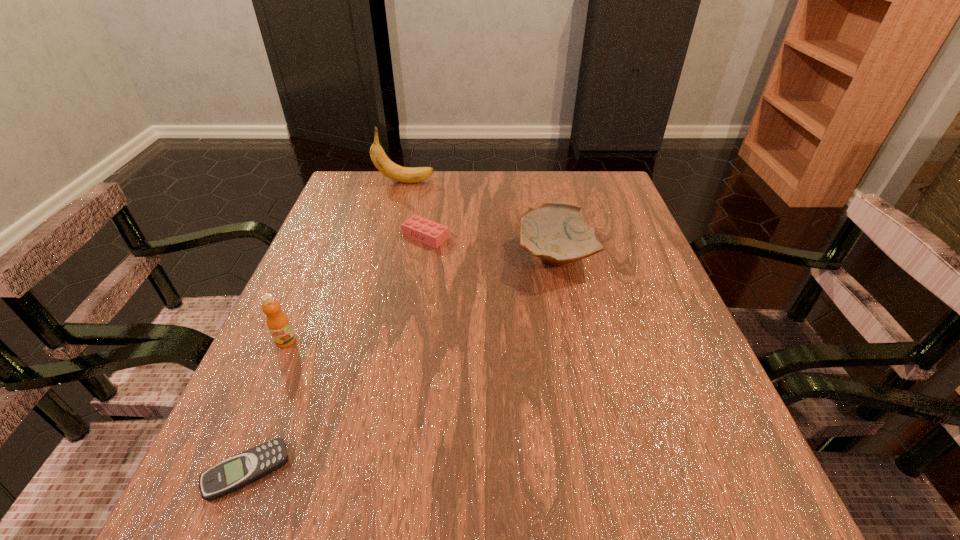
The width and height of the screenshot is (960, 540). What are the coordinates of `the tallest object` in the screenshot? It's located at (388, 168).

Locate an element on the screen. This screenshot has height=540, width=960. banana is located at coordinates (388, 168).

Identify the location of the second nearest object. (278, 324).

The width and height of the screenshot is (960, 540). In order to click on the fourth shortest object in this screenshot , I will do `click(278, 324)`.

I want to click on pottery, so click(555, 232).

Image resolution: width=960 pixels, height=540 pixels. What are the coordinates of `the rightmost object` in the screenshot? It's located at (555, 232).

I want to click on Lego, so click(x=420, y=229).

The width and height of the screenshot is (960, 540). I want to click on the nearest object, so click(x=242, y=469).

Where is `beeper`? beeper is located at coordinates (242, 469).

Locate an element on the screen. This screenshot has width=960, height=540. free space located at the start of the peel on the banana is located at coordinates (492, 182).